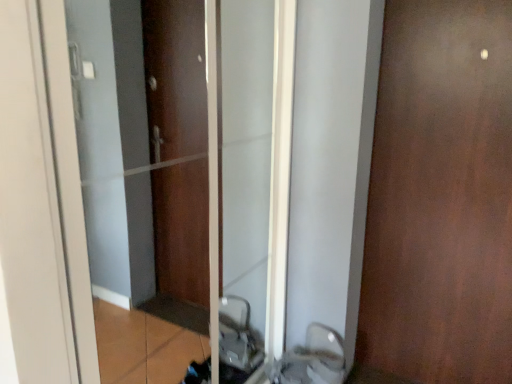
Where is `matte brown elevator at center`? matte brown elevator at center is located at coordinates (172, 167).

The image size is (512, 384). What do you see at coordinates (441, 196) in the screenshot?
I see `brown matte door at right` at bounding box center [441, 196].

The height and width of the screenshot is (384, 512). What are the coordinates of `matte brown elevator at center` in the screenshot? It's located at 172,167.

Is matte brown elevator at center spatially inside white glossy sink at lower center, or outside of it?

matte brown elevator at center is outside white glossy sink at lower center.

Considering the relative sizes of matte brown elevator at center and white glossy sink at lower center in the image provided, is matte brown elevator at center shorter than white glossy sink at lower center?

Incorrect, the height of matte brown elevator at center does not fall short of that of white glossy sink at lower center.

What's the angular difference between matte brown elevator at center and white glossy sink at lower center's facing directions?

The facing directions of matte brown elevator at center and white glossy sink at lower center are 0.976 degrees apart.

Is matte brown elevator at center directly adjacent to white glossy sink at lower center?

They are not placed beside each other.

Is matte brown elevator at center surrounded by brown matte door at right?

No, matte brown elevator at center is not a part of brown matte door at right.

Is brown matte door at right to the right of matte brown elevator at center from the viewer's perspective?

Indeed, brown matte door at right is positioned on the right side of matte brown elevator at center.

Is brown matte door at right wider than matte brown elevator at center?

No.

Is white glossy sink at lower center positioned far away from matte brown elevator at center?

Yes, white glossy sink at lower center is far from matte brown elevator at center.

This screenshot has height=384, width=512. In the image, there is a white glossy sink at lower center. In order to click on elevator above it (from the image's perspective) in this screenshot , I will do `click(172, 167)`.

Is white glossy sink at lower center facing away from matte brown elevator at center?

That's right, white glossy sink at lower center is facing away from matte brown elevator at center.

Based on the photo, considering the relative positions of white glossy sink at lower center and matte brown elevator at center in the image provided, is white glossy sink at lower center to the left or to the right of matte brown elevator at center?

In the image, white glossy sink at lower center appears on the right side of matte brown elevator at center.

Is matte brown elevator at center in contact with brown matte door at right?

No, matte brown elevator at center is not next to brown matte door at right.

From the image's perspective, which one is positioned higher, matte brown elevator at center or brown matte door at right?

brown matte door at right is shown above in the image.

Does matte brown elevator at center have a lesser height compared to brown matte door at right?

Yes, matte brown elevator at center is shorter than brown matte door at right.

Is matte brown elevator at center oriented away from brown matte door at right?

No, matte brown elevator at center is not facing away from brown matte door at right.

From a real-world perspective, who is located lower, brown matte door at right or white glossy sink at lower center?

white glossy sink at lower center, from a real-world perspective.

In the scene shown: Which is closer to the camera, (488, 299) or (281, 371)?

Point (488, 299) appears to be closer to the viewer than point (281, 371).

Would you say brown matte door at right is a long distance from white glossy sink at lower center?

No, brown matte door at right is not far away from white glossy sink at lower center.

From the image's perspective, does brown matte door at right appear higher than white glossy sink at lower center?

Indeed, from the image's perspective, brown matte door at right is shown above white glossy sink at lower center.

Can you confirm if white glossy sink at lower center is bigger than brown matte door at right?

No, white glossy sink at lower center is not bigger than brown matte door at right.

Who is more distant, white glossy sink at lower center or brown matte door at right?

white glossy sink at lower center is further away from the camera.

Does point (318, 337) lie behind point (495, 111)?

Yes, it is.

The image size is (512, 384). In order to click on sink below the matte brown elevator at center (from a real-world perspective) in this screenshot , I will do click(x=312, y=359).

The width and height of the screenshot is (512, 384). I want to click on door to the right of matte brown elevator at center, so (x=441, y=196).

Looking at the image, which one is located further to brown matte door at right, matte brown elevator at center or white glossy sink at lower center?

matte brown elevator at center lies further to brown matte door at right than the other object.

Which object lies further to the anchor point matte brown elevator at center, brown matte door at right or white glossy sink at lower center?

brown matte door at right is further to matte brown elevator at center.

When comparing their distances from matte brown elevator at center, does white glossy sink at lower center or brown matte door at right seem closer?

white glossy sink at lower center lies closer to matte brown elevator at center than the other object.

Which object lies further to the anchor point brown matte door at right, white glossy sink at lower center or matte brown elevator at center?

The object further to brown matte door at right is matte brown elevator at center.

From the image, which object appears to be farther from white glossy sink at lower center, brown matte door at right or matte brown elevator at center?

Among the two, matte brown elevator at center is located further to white glossy sink at lower center.

Estimate the real-world distances between objects in this image. Which object is closer to white glossy sink at lower center, matte brown elevator at center or brown matte door at right?

brown matte door at right lies closer to white glossy sink at lower center than the other object.

This screenshot has height=384, width=512. Identify the location of sink between matte brown elevator at center and brown matte door at right in the horizontal direction. (312, 359).